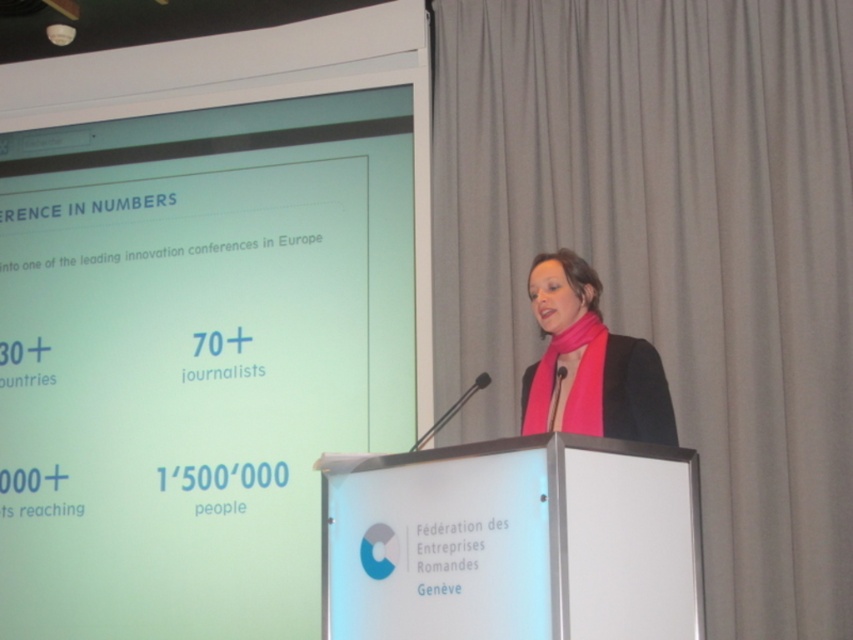
A photographer wants to capture a photo of the woman at the podium and the projection screen behind her. The photographer is standing at point (57,563). What is the minimum distance the photographer needs to move to ensure both the woman and the screen are fully visible in the frame?

The photographer needs to move at least 4.55 meters to ensure both the woman at the podium and the projection screen are fully visible in the frame.

You are an event planner checking the setup for the upcoming conference. You need to ensure that the white glossy projection screen at upper left and the pink fabric scarf at center are visible to all attendees. Considering their sizes, which object might be more challenging to see from the back of the room?

The pink fabric scarf at center might be more challenging to see from the back of the room because it is smaller than the white glossy projection screen at upper left.